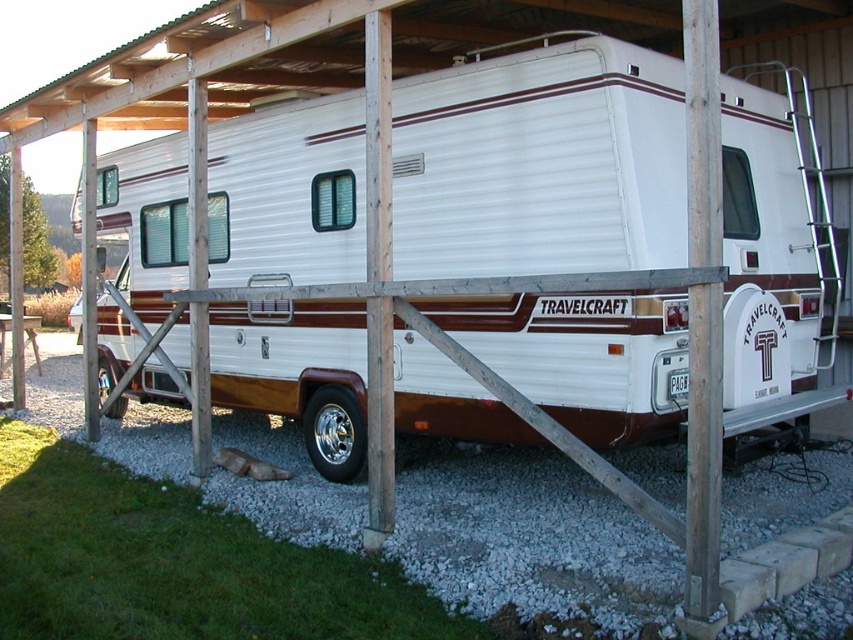
Question: Is white glossy recreational vehicle at center closer to the viewer compared to white gravel at lower center?

Choices:
 (A) no
 (B) yes

Answer: (A)

Question: Which point is closer to the camera?

Choices:
 (A) (671, 563)
 (B) (306, 232)

Answer: (A)

Question: Does white glossy recreational vehicle at center have a lesser width compared to white gravel at lower center?

Choices:
 (A) yes
 (B) no

Answer: (A)

Question: Is white glossy recreational vehicle at center positioned in front of white gravel at lower center?

Choices:
 (A) yes
 (B) no

Answer: (B)